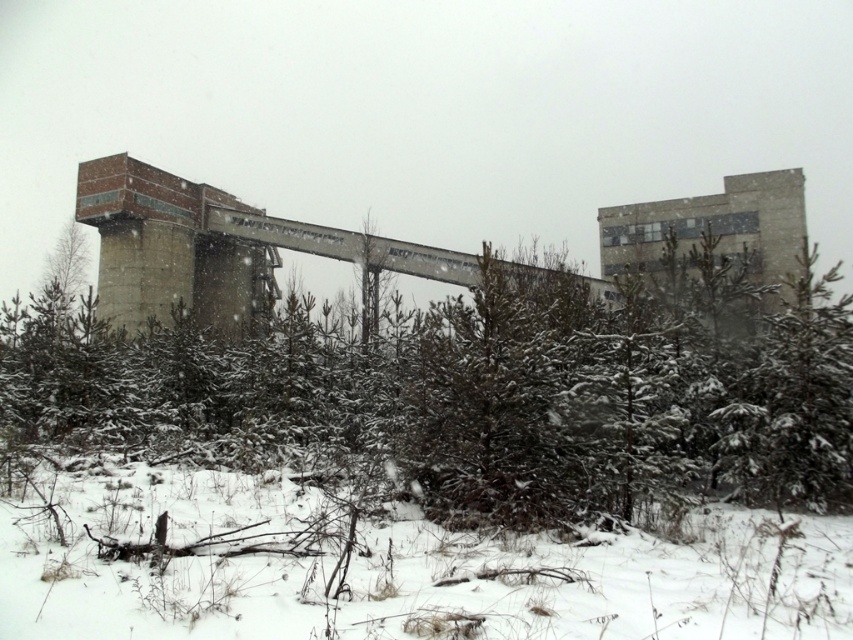
Is point (398, 566) more distant than point (830, 308)?

No, (398, 566) is in front of (830, 308).

Is white fluffy snow at lower center bigger than green matte tree at center-right?

Actually, white fluffy snow at lower center might be smaller than green matte tree at center-right.

Locate an element on the screen. white fluffy snow at lower center is located at coordinates [x=407, y=573].